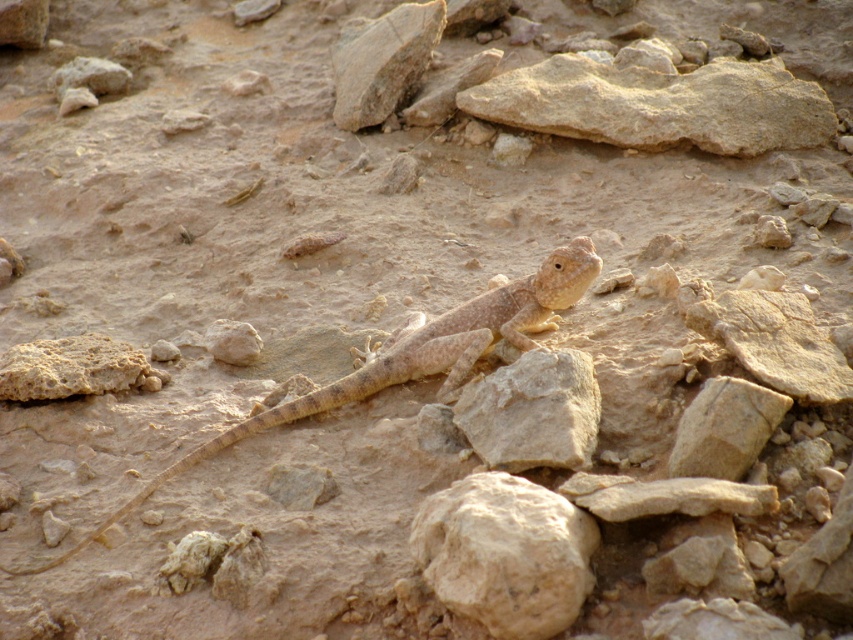
Is point (508, 486) farther from viewer compared to point (415, 355)?

No.

Does smooth beige rock at center have a smaller size compared to desert-dusted lizard at center?

Yes.

Does point (451, 582) come in front of point (585, 268)?

Yes, point (451, 582) is in front of point (585, 268).

This screenshot has width=853, height=640. Identify the location of smooth beige rock at center. tap(505, 554).